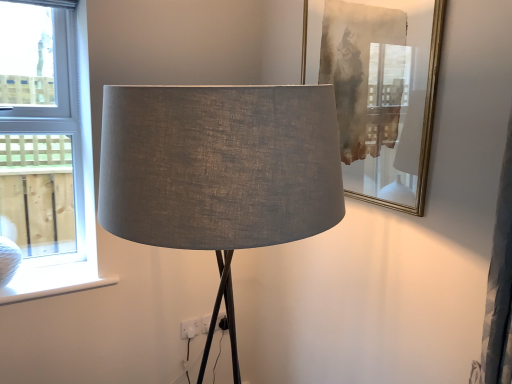
Question: Is white plastic window at left spatially inside matte gray fabric lampshade at center, or outside of it?

Choices:
 (A) inside
 (B) outside

Answer: (B)

Question: In the image, is white plastic window at left on the left side or the right side of matte gray fabric lampshade at center?

Choices:
 (A) left
 (B) right

Answer: (A)

Question: Which object is positioned closest to the white plastic electric outlet at lower center?

Choices:
 (A) matte gray fabric lampshade at center
 (B) white matte window sill at lower left
 (C) matte gold picture frame at upper right
 (D) white plastic window at left

Answer: (B)

Question: Estimate the real-world distances between objects in this image. Which object is farther from the matte gray fabric lampshade at center?

Choices:
 (A) white plastic electric outlet at lower center
 (B) white plastic window at left
 (C) matte gold picture frame at upper right
 (D) white matte window sill at lower left

Answer: (A)